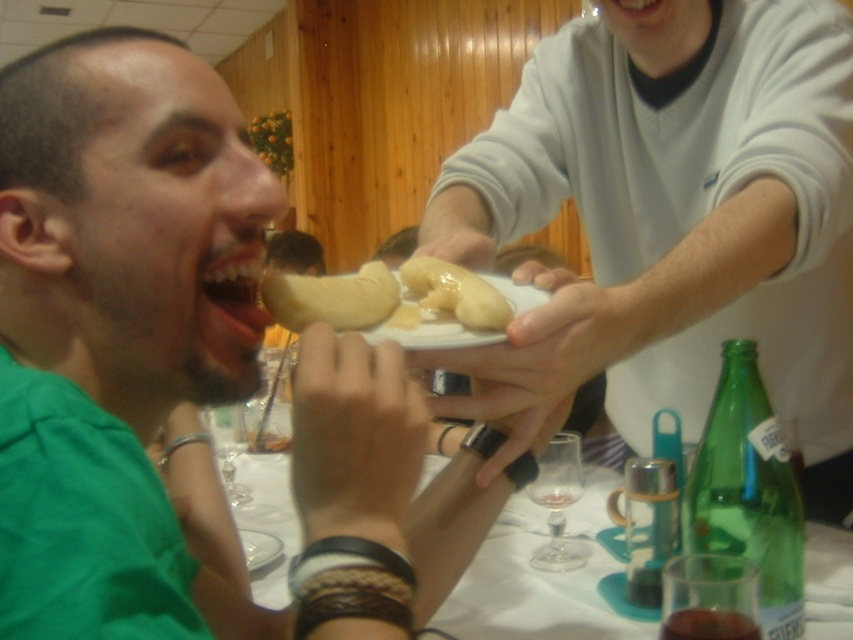
Can you confirm if smooth white plate at center is thinner than yellowish matte banana at mouth?

In fact, smooth white plate at center might be wider than yellowish matte banana at mouth.

Who is positioned more to the left, smooth white plate at center or yellowish matte banana at mouth?

From the viewer's perspective, yellowish matte banana at mouth appears more on the left side.

Is point (700, 129) positioned after point (316, 308)?

Yes, point (700, 129) is behind point (316, 308).

This screenshot has width=853, height=640. I want to click on smooth white plate at center, so click(x=675, y=218).

Based on the photo, between yellowish matte banana at mouth and yellowish matte banana at center, which one appears on the left side from the viewer's perspective?

yellowish matte banana at mouth is more to the left.

Describe the element at coordinates (331, 298) in the screenshot. I see `yellowish matte banana at mouth` at that location.

Who is more forward, (399, 289) or (463, 308)?

Point (463, 308) is more forward.

Locate an element on the screen. This screenshot has height=640, width=853. yellowish matte banana at mouth is located at coordinates (331, 298).

Which of these two, yellowish matte banana at mouth or white matte plate at center, stands shorter?

With less height is yellowish matte banana at mouth.

Does yellowish matte banana at mouth appear on the right side of white matte plate at center?

In fact, yellowish matte banana at mouth is to the left of white matte plate at center.

I want to click on yellowish matte banana at mouth, so click(x=331, y=298).